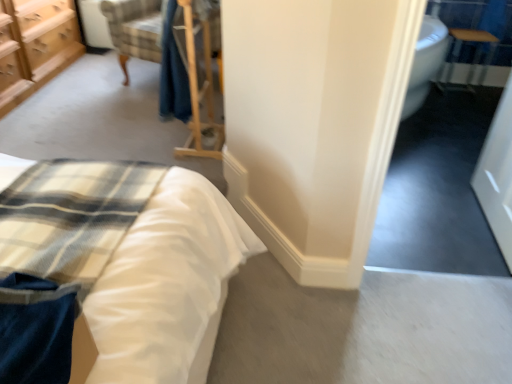
Question: Is point (97, 360) positioned closer to the camera than point (506, 170)?

Choices:
 (A) farther
 (B) closer

Answer: (B)

Question: From a real-world perspective, relative to white glossy door at right, is satin white bed at lower left vertically above or below?

Choices:
 (A) above
 (B) below

Answer: (B)

Question: Which is farther from the wooden table at upper right?

Choices:
 (A) satin white bed at lower left
 (B) white glossy door at right
 (C) wooden chest of drawers at upper left

Answer: (C)

Question: Which object is the closest to the satin white bed at lower left?

Choices:
 (A) wooden chest of drawers at upper left
 (B) white glossy door at right
 (C) wooden table at upper right

Answer: (B)